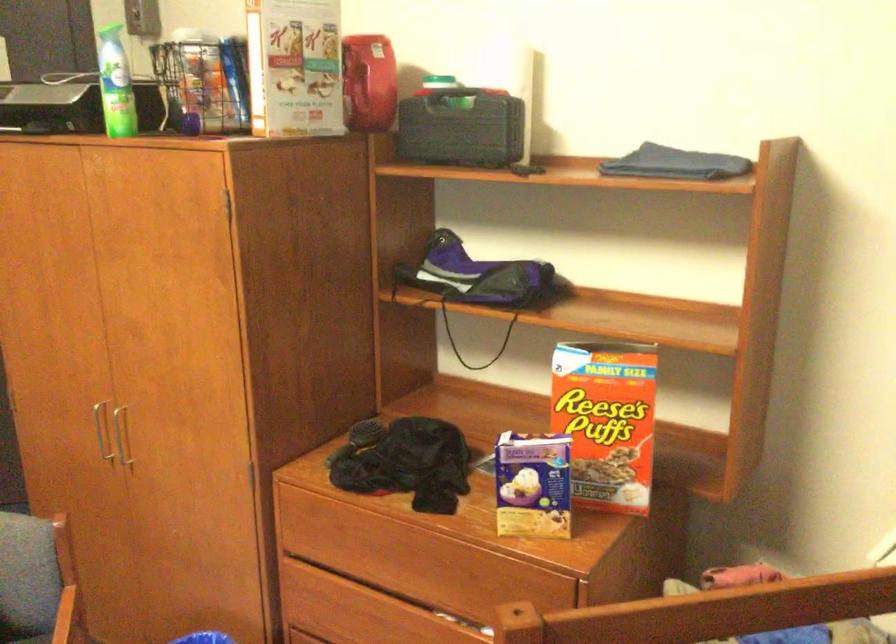
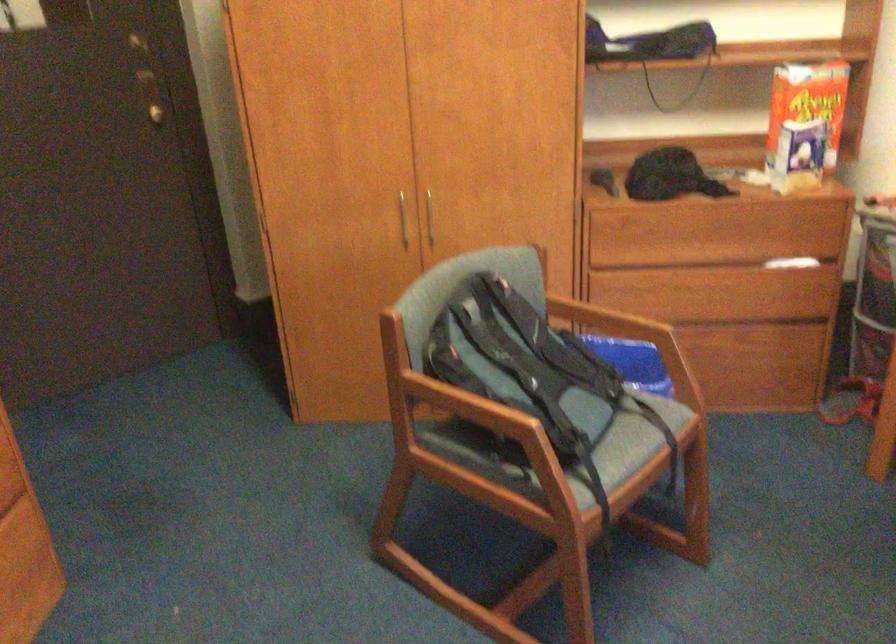
The point at (566, 415) is marked in the first image. Where is the corresponding point in the second image?

(807, 102)